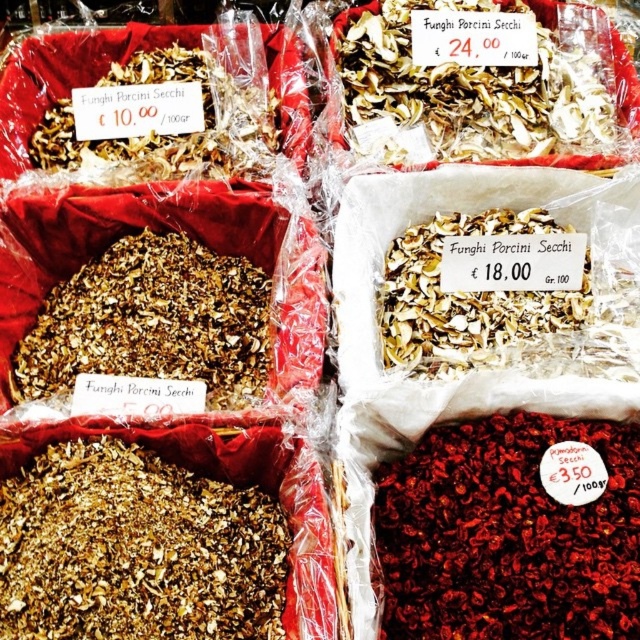
Question: Is brown crumbly funghi porcini secchi at lower left wider than white dried mushrooms at upper center?

Choices:
 (A) no
 (B) yes

Answer: (A)

Question: Based on their relative distances, which object is nearer to the white dried mushrooms at upper center?

Choices:
 (A) brown dried mushrooms at upper left
 (B) brown crumbly funghi porcini secchi at lower left

Answer: (A)

Question: Which point is farther from the camera taking this photo?

Choices:
 (A) (260, 340)
 (B) (580, 148)
 (C) (156, 144)

Answer: (B)

Question: Which object is positioned closest to the dried red berries at lower right?

Choices:
 (A) white dried mushrooms at upper center
 (B) brown dried mushrooms at upper left
 (C) brown crumbly dried mushrooms at center

Answer: (C)

Question: In this image, where is dried red berries at lower right located relative to brown crumbly funghi porcini secchi at lower left?

Choices:
 (A) below
 (B) above

Answer: (A)

Question: Is brown crumbly dried mushrooms at center in front of white dried mushrooms at upper center?

Choices:
 (A) yes
 (B) no

Answer: (A)